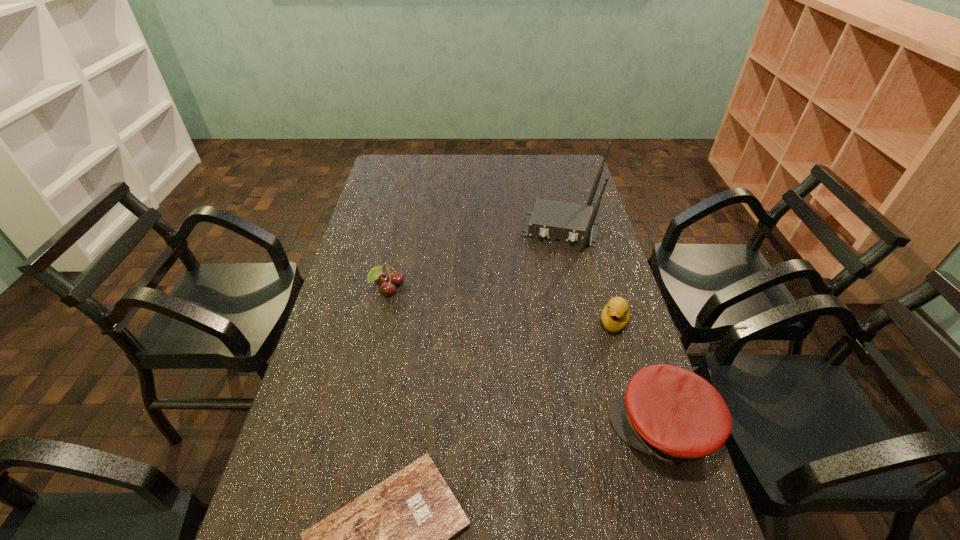
The image size is (960, 540). Find the location of `free location that satisfies the following two spatial constraints: 1. on the front side of the fourth nearest object; 2. on the left side of the third nearest object`. free location that satisfies the following two spatial constraints: 1. on the front side of the fourth nearest object; 2. on the left side of the third nearest object is located at coordinates (381, 322).

Locate an element on the screen. The width and height of the screenshot is (960, 540). free space that satisfies the following two spatial constraints: 1. on the front side of the router; 2. on the front of the cap with an emblem is located at coordinates (605, 429).

This screenshot has width=960, height=540. I want to click on vacant point that satisfies the following two spatial constraints: 1. on the front side of the duckling; 2. on the right side of the second farthest object, so click(381, 322).